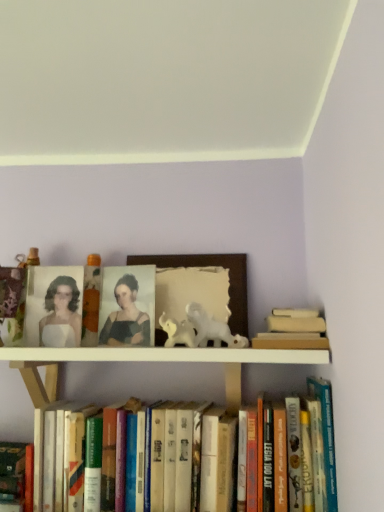
Question: Is hardcover books at lower center, the 2th book positioned from the left, positioned in front of beige cardboard book at upper right, acting as the first book starting from the right?

Choices:
 (A) yes
 (B) no

Answer: (A)

Question: Are hardcover books at lower center, the 2th book positioned from the left, and beige cardboard book at upper right, placed as the third book when sorted from left to right, far apart?

Choices:
 (A) no
 (B) yes

Answer: (A)

Question: Is the position of hardcover books at lower center, the 2th book positioned from the left, more distant than that of beige cardboard book at upper right, acting as the first book starting from the right?

Choices:
 (A) yes
 (B) no

Answer: (B)

Question: Does hardcover books at lower center, which ranks as the second book in right-to-left order, have a smaller size compared to beige cardboard book at upper right, acting as the first book starting from the right?

Choices:
 (A) yes
 (B) no

Answer: (B)

Question: Is the surface of hardcover books at lower center, which ranks as the second book in right-to-left order, in direct contact with beige cardboard book at upper right, placed as the third book when sorted from left to right?

Choices:
 (A) no
 (B) yes

Answer: (A)

Question: From a real-world perspective, is hardcover books at lower center, the 2th book positioned from the left, located higher than beige cardboard book at upper right, placed as the third book when sorted from left to right?

Choices:
 (A) no
 (B) yes

Answer: (A)

Question: Is matte white portrait at upper left located outside hardcover book at lower left, which is the first book from left to right?

Choices:
 (A) yes
 (B) no

Answer: (A)

Question: Is matte white portrait at upper left touching hardcover book at lower left, the third book when ordered from right to left?

Choices:
 (A) no
 (B) yes

Answer: (A)

Question: Does matte white portrait at upper left have a lesser width compared to hardcover book at lower left, which is the first book from left to right?

Choices:
 (A) no
 (B) yes

Answer: (B)

Question: Can you confirm if matte white portrait at upper left is bigger than hardcover book at lower left, which is the first book from left to right?

Choices:
 (A) yes
 (B) no

Answer: (B)

Question: From a real-world perspective, does matte white portrait at upper left stand above hardcover book at lower left, the third book when ordered from right to left?

Choices:
 (A) yes
 (B) no

Answer: (A)

Question: Considering the relative positions of matte white portrait at upper left and hardcover book at lower left, which is the first book from left to right, in the image provided, is matte white portrait at upper left in front of hardcover book at lower left, which is the first book from left to right,?

Choices:
 (A) yes
 (B) no

Answer: (B)

Question: Considering the relative positions of hardcover books at lower center, which ranks as the second book in right-to-left order, and matte orange candle at upper center in the image provided, is hardcover books at lower center, which ranks as the second book in right-to-left order, to the left of matte orange candle at upper center from the viewer's perspective?

Choices:
 (A) yes
 (B) no

Answer: (B)